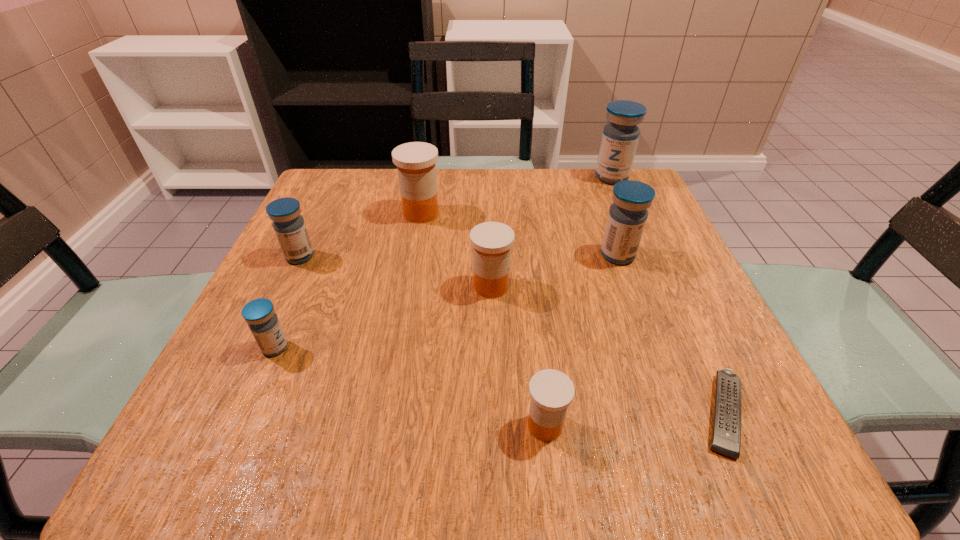
Select which blue medicine is the second closest to the second biggest blue medicine. Please provide its 2D coordinates. Your answer should be formatted as a tuple, i.e. [(x, y)], where the tuple contains the x and y coordinates of a point satisfying the conditions above.

[(289, 226)]

Point out which orange medicine is positioned as the second nearest to the nearest blue medicine. Please provide its 2D coordinates. Your answer should be formatted as a tuple, i.e. [(x, y)], where the tuple contains the x and y coordinates of a point satisfying the conditions above.

[(416, 161)]

Identify the location of orange medicine that can be found as the second closest to the second nearest orange medicine. The width and height of the screenshot is (960, 540). (551, 391).

In order to click on blank space that satisfies the following two spatial constraints: 1. on the label of the farthest orange medicine; 2. on the right side of the third smallest blue medicine in this screenshot , I will do `click(414, 255)`.

The width and height of the screenshot is (960, 540). What are the coordinates of `vacant space that satisfies the following two spatial constraints: 1. on the label of the third nearest medicine; 2. on the left side of the shortest object` in the screenshot? It's located at pyautogui.click(x=494, y=413).